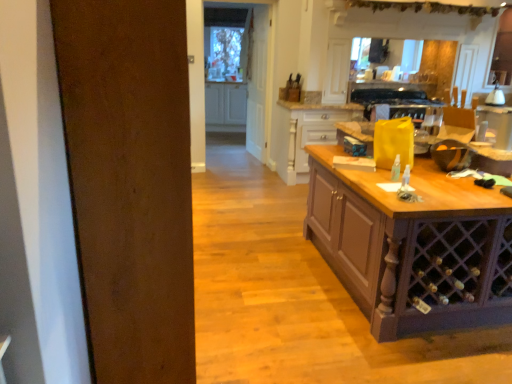
Measure the distance between point (261, 113) and camera.

The distance of point (261, 113) from camera is 20.22 feet.

Describe the element at coordinates (395, 102) in the screenshot. The height and width of the screenshot is (384, 512). I see `black glass oven at upper center` at that location.

What is the approximate height of white wood door at center?

The height of white wood door at center is 1.97 meters.

You are a GUI agent. You are given a task and a screenshot of the screen. Output one action in this format:
    pyautogui.click(x=<x>, y=<y>)
    Task: Click on the clear glass door at center
    
    Given the screenshot: What is the action you would take?
    pyautogui.click(x=257, y=79)

Identify the location of cabinetry located in front of the white glossy cabinet at center, the second cabinetry positioned from the bottom. (306, 134).

In the image, is white glossy cabinet at center, the 1th cabinetry positioned from the left, positioned in front of or behind wooden drawer at center, the second cabinetry when ordered from top to bottom?

Visually, white glossy cabinet at center, the 1th cabinetry positioned from the left, is located behind wooden drawer at center, the second cabinetry when ordered from top to bottom.

Is white glossy cabinet at center, the 2th cabinetry positioned from the front, thinner than wooden drawer at center, placed as the second cabinetry when sorted from left to right?

Yes.

Considering the relative sizes of white wood door at center and white glossy cabinet at center, the 1th cabinetry positioned from the left, in the image provided, is white wood door at center smaller than white glossy cabinet at center, the 1th cabinetry positioned from the left,?

Yes, white wood door at center is smaller than white glossy cabinet at center, the 1th cabinetry positioned from the left.

Is white wood door at center aimed at white glossy cabinet at center, the 1th cabinetry when ordered from top to bottom?

No, white wood door at center is not oriented towards white glossy cabinet at center, the 1th cabinetry when ordered from top to bottom.

From the image's perspective, does white wood door at center appear lower than white glossy cabinet at center, the 1th cabinetry when ordered from top to bottom?

Yes.

Which of these two, white wood door at center or white glossy cabinet at center, the second cabinetry positioned from the bottom, stands shorter?

With less height is white glossy cabinet at center, the second cabinetry positioned from the bottom.

From a real-world perspective, who is located lower, black glass oven at upper center or wooden drawer at center, the second cabinetry viewed from the back?

wooden drawer at center, the second cabinetry viewed from the back.

Is black glass oven at upper center inside the boundaries of wooden drawer at center, the second cabinetry viewed from the back, or outside?

black glass oven at upper center is outside wooden drawer at center, the second cabinetry viewed from the back.

Is black glass oven at upper center oriented towards wooden drawer at center, the second cabinetry when ordered from top to bottom?

No, black glass oven at upper center is not turned towards wooden drawer at center, the second cabinetry when ordered from top to bottom.

Which object is positioned more to the right, black glass oven at upper center or wooden drawer at center, the second cabinetry when ordered from top to bottom?

Positioned to the right is black glass oven at upper center.

The height and width of the screenshot is (384, 512). I want to click on kitchen appliance above the wooden table at right (from a real-world perspective), so click(495, 96).

Between white glossy lamp at upper right and wooden table at right, which one has less height?

With less height is white glossy lamp at upper right.

Between point (486, 97) and point (395, 220), which one is positioned in front?

Positioned in front is point (395, 220).

Is wooden table at right facing towards white glossy lamp at upper right?

No, wooden table at right is not facing towards white glossy lamp at upper right.

Based on their positions, is wooden table at right located to the left or right of white glossy lamp at upper right?

wooden table at right is positioned on white glossy lamp at upper right's left side.

From the picture: In terms of width, does wooden table at right look wider or thinner when compared to white glossy lamp at upper right?

Clearly, wooden table at right has more width compared to white glossy lamp at upper right.

From the image's perspective, between wooden table at right and white glossy lamp at upper right, who is located below?

wooden table at right appears lower in the image.

Is white glossy cabinet at center, the 2th cabinetry positioned from the front, turned away from clear glass door at center?

That's not correct — white glossy cabinet at center, the 2th cabinetry positioned from the front, is not looking away from clear glass door at center.

From the image's perspective, relative to clear glass door at center, is white glossy cabinet at center, which is the 2th cabinetry from right to left, above or below?

white glossy cabinet at center, which is the 2th cabinetry from right to left, is above clear glass door at center.

Measure the distance between white glossy cabinet at center, the 1th cabinetry positioned from the left, and clear glass door at center.

white glossy cabinet at center, the 1th cabinetry positioned from the left, is 1.47 meters from clear glass door at center.

Looking at the image, does white glossy cabinet at center, the 1th cabinetry when ordered from top to bottom, seem bigger or smaller compared to clear glass door at center?

Considering their sizes, white glossy cabinet at center, the 1th cabinetry when ordered from top to bottom, takes up more space than clear glass door at center.

Is clear glass door at center surrounded by black glass oven at upper center?

No, black glass oven at upper center does not contain clear glass door at center.

Is black glass oven at upper center facing towards clear glass door at center?

No, black glass oven at upper center is not oriented towards clear glass door at center.

Measure the distance between black glass oven at upper center and clear glass door at center.

black glass oven at upper center is 1.77 meters from clear glass door at center.

Can you see black glass oven at upper center touching clear glass door at center?

No, black glass oven at upper center is not next to clear glass door at center.

I want to click on cabinetry behind the wooden drawer at center, placed as the second cabinetry when sorted from left to right, so click(x=225, y=104).

I want to click on door above the white glossy cabinet at center, the second cabinetry positioned from the bottom (from a real-world perspective), so click(257, 81).

From the image, which object appears to be farther from wooden table at right, white wood door at center or white glossy cabinet at center, the second cabinetry positioned from the bottom?

white glossy cabinet at center, the second cabinetry positioned from the bottom.

Estimate the real-world distances between objects in this image. Which object is closer to white wood door at center, wooden table at right or white glossy cabinet at center, which is the 2th cabinetry from right to left?

white glossy cabinet at center, which is the 2th cabinetry from right to left, is closer to white wood door at center.

Considering their positions, is white glossy cabinet at center, the 2th cabinetry positioned from the front, positioned further to black glass oven at upper center than clear glass door at center?

white glossy cabinet at center, the 2th cabinetry positioned from the front, is further to black glass oven at upper center.

Considering their positions, is white glossy lamp at upper right positioned closer to white glossy cabinet at center, the 1th cabinetry positioned from the left, than black glass oven at upper center?

black glass oven at upper center is closer to white glossy cabinet at center, the 1th cabinetry positioned from the left.

Estimate the real-world distances between objects in this image. Which object is closer to clear glass door at center, black glass oven at upper center or white glossy cabinet at center, the 1th cabinetry positioned from the left?

The object closer to clear glass door at center is white glossy cabinet at center, the 1th cabinetry positioned from the left.

Consider the image. Considering their positions, is white wood door at center positioned closer to wooden drawer at center, placed as the second cabinetry when sorted from left to right, than white glossy cabinet at center, the 1th cabinetry positioned from the left?

white wood door at center is positioned closer to the anchor wooden drawer at center, placed as the second cabinetry when sorted from left to right.

When comparing their distances from wooden table at right, does clear glass door at center or white wood door at center seem closer?

Among the two, white wood door at center is located nearer to wooden table at right.

In the scene shown: Looking at the image, which one is located further to wooden drawer at center, placed as the first cabinetry when sorted from bottom to top, black glass oven at upper center or white wood door at center?

Among the two, white wood door at center is located further to wooden drawer at center, placed as the first cabinetry when sorted from bottom to top.

Locate an element on the screen. The image size is (512, 384). oven positioned between wooden table at right and white glossy lamp at upper right from near to far is located at coordinates point(395,102).

Find the location of a particular element. The image size is (512, 384). cabinetry located between wooden table at right and white glossy lamp at upper right in the depth direction is located at coordinates (306, 134).

You are a GUI agent. You are given a task and a screenshot of the screen. Output one action in this format:
    pyautogui.click(x=<x>, y=<y>)
    Task: Click on the glass door located between wooden table at right and white glossy lamp at upper right in the depth direction
    This screenshot has width=512, height=384.
    Given the screenshot: What is the action you would take?
    pos(257,79)

I want to click on glass door between wooden table at right and white glossy cabinet at center, arranged as the 1th cabinetry when viewed from the back, in the front-back direction, so click(257, 79).